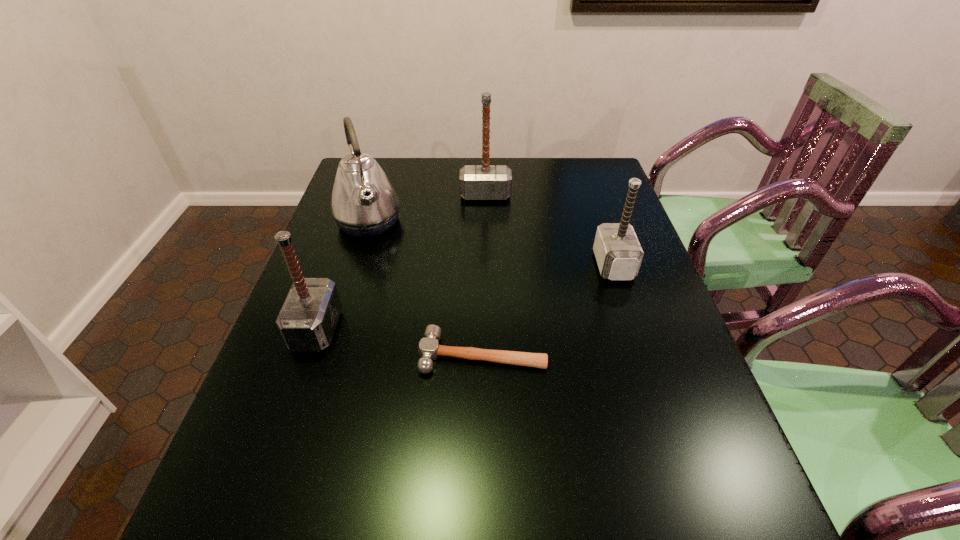
Locate an element on the screen. free spot at the near right corner of the desktop is located at coordinates (706, 525).

Image resolution: width=960 pixels, height=540 pixels. I want to click on free space between the leftmost hammer and the kettle, so click(x=343, y=276).

Where is `vacant space that's between the leftmost hammer and the kettle`? This screenshot has width=960, height=540. vacant space that's between the leftmost hammer and the kettle is located at coordinates (343, 276).

Where is `empty location between the shortest object and the third nearest hammer`? The width and height of the screenshot is (960, 540). empty location between the shortest object and the third nearest hammer is located at coordinates (548, 310).

You are a GUI agent. You are given a task and a screenshot of the screen. Output one action in this format:
    pyautogui.click(x=<x>, y=<y>)
    Task: Click on the vacant region between the leftmost hammer and the kettle
    The image size is (960, 540).
    Given the screenshot: What is the action you would take?
    pyautogui.click(x=343, y=276)

I want to click on empty space that is in between the shortest object and the third farthest object, so click(x=548, y=310).

Locate an element on the screen. The image size is (960, 540). free area in between the shortest object and the third nearest hammer is located at coordinates (548, 310).

In order to click on free spot between the shortest object and the kettle in this screenshot , I will do click(425, 288).

At what (x,y) coordinates should I click in order to perform the action: click on vacant area between the tallest hammer and the shortest hammer. Please return your answer as a coordinate pair (x, y). The image size is (960, 540). Looking at the image, I should click on (484, 275).

I want to click on free space between the shortest object and the tallest hammer, so click(484, 275).